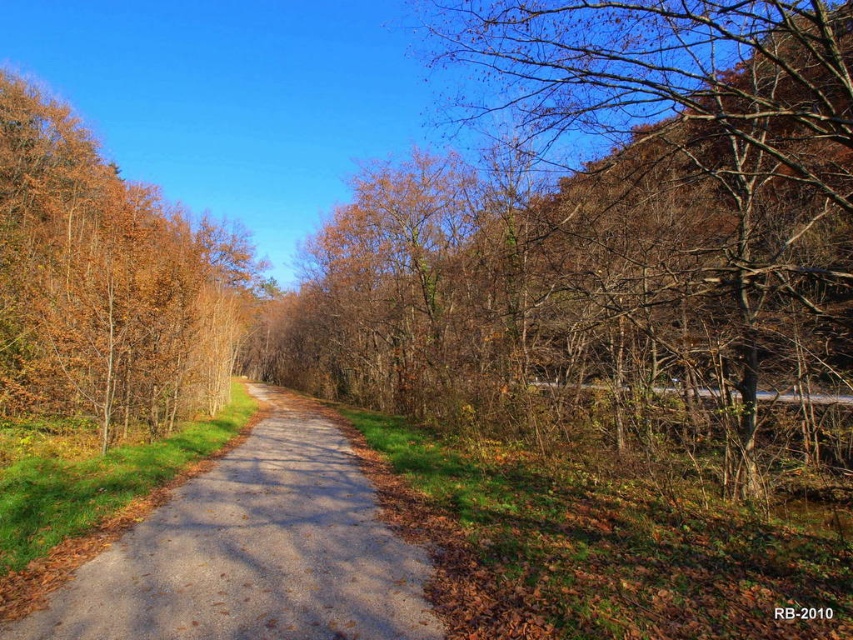
Question: Which of the following is the closest to the observer?

Choices:
 (A) (792, 54)
 (B) (128, 344)

Answer: (A)

Question: Is brown leafy tree at left further to the viewer compared to gray asphalt trail at center?

Choices:
 (A) yes
 (B) no

Answer: (A)

Question: Is brown leafy tree at left positioned at the back of gray asphalt trail at center?

Choices:
 (A) no
 (B) yes

Answer: (B)

Question: In this image, where is brown leafy tree at upper right located relative to brown leafy tree at left?

Choices:
 (A) below
 (B) above

Answer: (A)

Question: Which point is closer to the camera taking this photo?

Choices:
 (A) 252,298
 (B) 82,609

Answer: (B)

Question: Which point appears farthest from the camera in this image?

Choices:
 (A) (192, 260)
 (B) (398, 620)

Answer: (A)